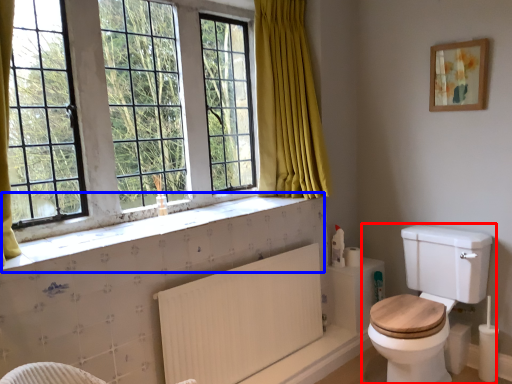
Question: Among these objects, which one is farthest to the camera, toilet (highlighted by a red box) or window sill (highlighted by a blue box)?

Choices:
 (A) toilet
 (B) window sill

Answer: (A)